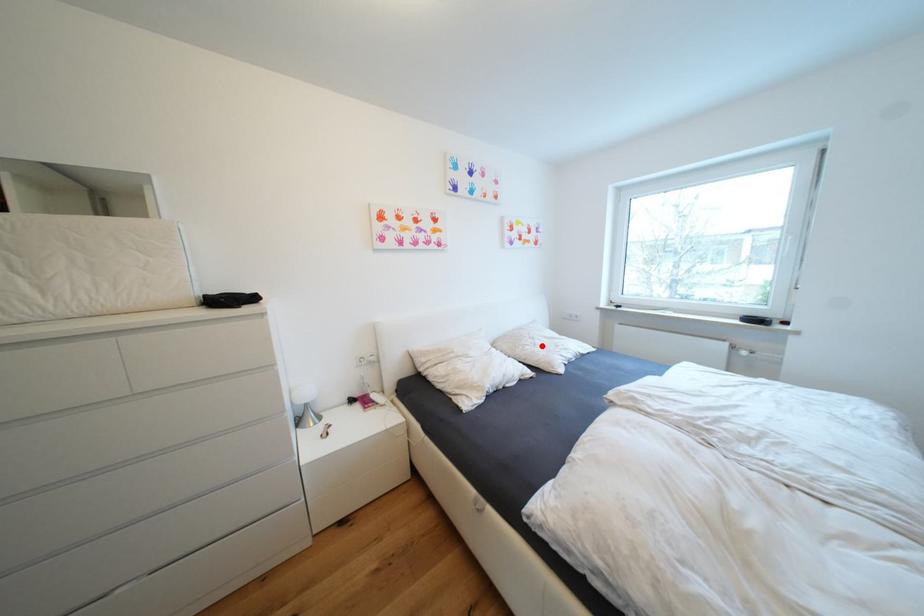
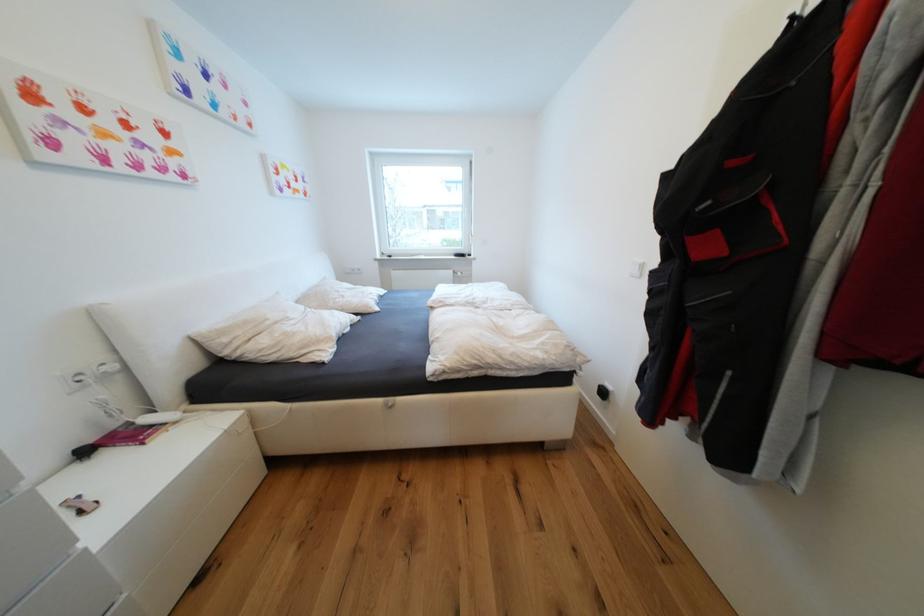
Question: I am providing you with two images of the same scene from different viewpoints. A red point is shown in image1. For the corresponding object point in image2, is it positioned nearer or farther from the camera?

Choices:
 (A) Nearer
 (B) Farther

Answer: (A)